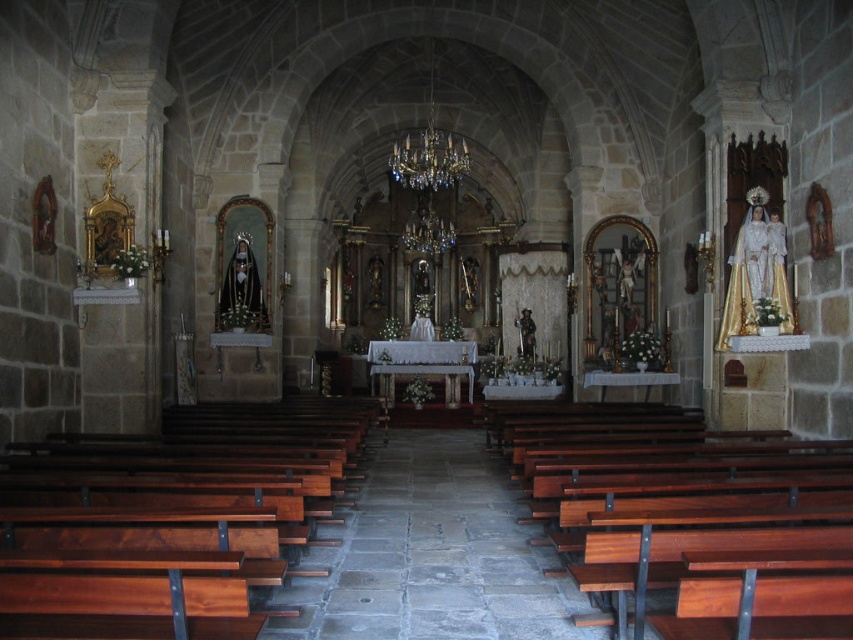
You are an interior designer planning to place a 1.2 meter wide decorative item in the church. You have two options for placement areas based on the existing objects. Which object, the brown polished wood at left or the polished wood bench at lower right, would allow the item to fit better in terms of width?

The brown polished wood at left has a greater width than the polished wood bench at lower right, so placing the 1.2 meter wide decorative item on the brown polished wood at left would be more suitable as it can accommodate the item better in terms of width.

You are standing at the entrance of the church and looking towards the altar. There are two points marked in the image, point 1 at coordinates point (287,461) and point 2 at coordinates point (584,513). Which point is closer to you?

Point (287,461) is closer to you because it is further to the camera than point (584,513).